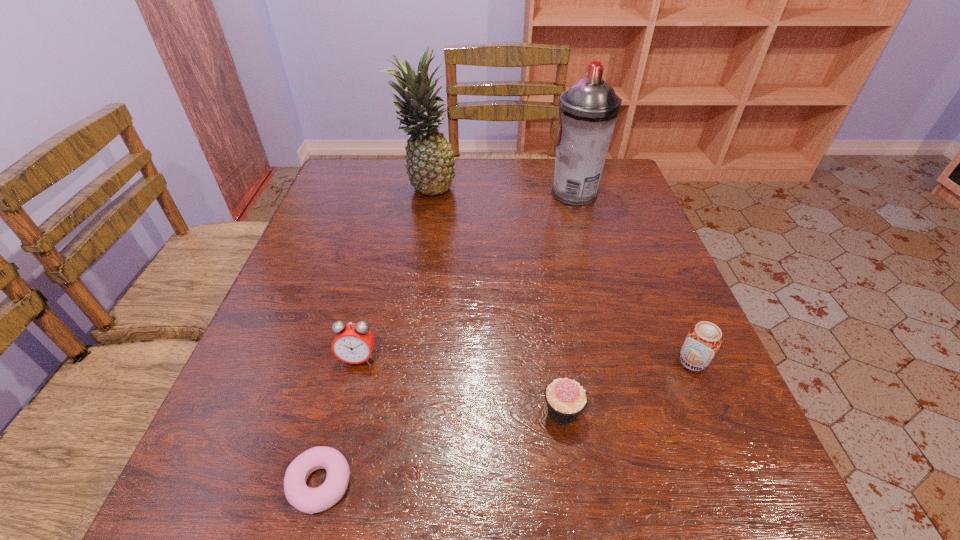
You are a GUI agent. You are given a task and a screenshot of the screen. Output one action in this format:
    pyautogui.click(x=<x>, y=<y>)
    Task: Click on the pineapple
    
    Given the screenshot: What is the action you would take?
    pyautogui.click(x=429, y=157)

This screenshot has width=960, height=540. In order to click on aerosol can in this screenshot , I will do `click(588, 111)`.

Locate an element on the screen. This screenshot has width=960, height=540. alarm clock is located at coordinates (353, 343).

At what (x,y) coordinates should I click in order to perform the action: click on the rightmost object. Please return your answer as a coordinate pair (x, y). Looking at the image, I should click on (704, 339).

This screenshot has height=540, width=960. What are the coordinates of `the fifth farthest object` in the screenshot? It's located at click(x=566, y=399).

The height and width of the screenshot is (540, 960). Find the location of `the third object from right to left`. the third object from right to left is located at coordinates (566, 399).

Identify the location of the nearest object. This screenshot has width=960, height=540. (309, 500).

Where is `the shortest object`? This screenshot has height=540, width=960. the shortest object is located at coordinates (309, 500).

Locate an element on the screen. The width and height of the screenshot is (960, 540). vacant space located 0.200m on the front of the pineapple is located at coordinates (417, 249).

Find the location of a particular element. vacant point located on the left of the fifth object from left to right is located at coordinates (441, 193).